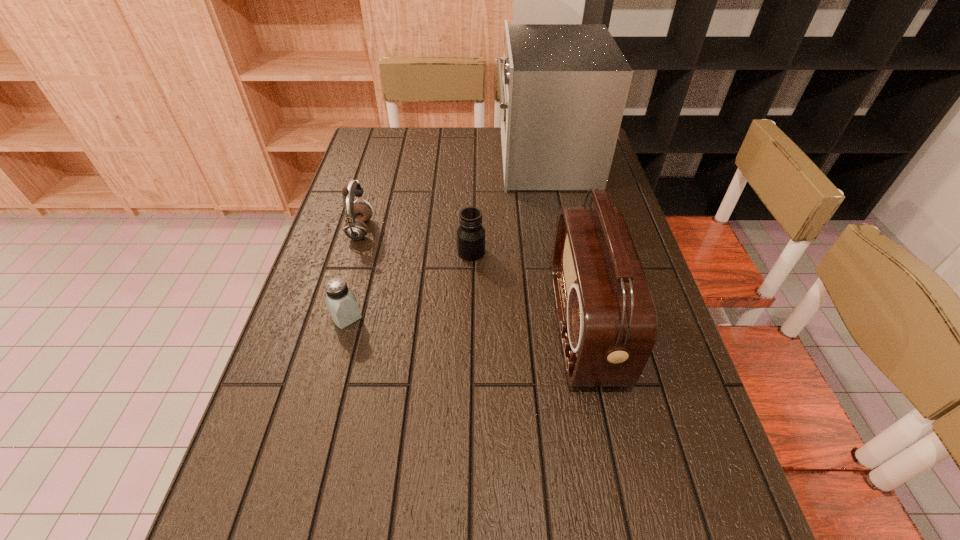
Image resolution: width=960 pixels, height=540 pixels. I want to click on object at the far right corner, so click(564, 87).

In order to click on vacant space at the far edge in this screenshot , I will do `click(414, 152)`.

Where is `free space at the left edge of the desktop`? free space at the left edge of the desktop is located at coordinates (359, 259).

I want to click on vacant space at the far left corner of the desktop, so click(x=401, y=156).

Identify the location of free spot between the shortest object and the radio receiver. This screenshot has height=540, width=960. (466, 322).

Identify the location of empty space that is in between the saltshaker and the toaster oven. [x=445, y=239].

The image size is (960, 540). Find the location of `vacant space that is in between the saltshaker and the toaster oven`. vacant space that is in between the saltshaker and the toaster oven is located at coordinates (445, 239).

The height and width of the screenshot is (540, 960). I want to click on vacant area between the saltshaker and the fourth shortest object, so click(x=466, y=322).

Locate an element on the screen. The height and width of the screenshot is (540, 960). vacant point located between the earphone and the radio receiver is located at coordinates (472, 279).

Find the location of `free spot between the jar and the third tallest object`. free spot between the jar and the third tallest object is located at coordinates (416, 241).